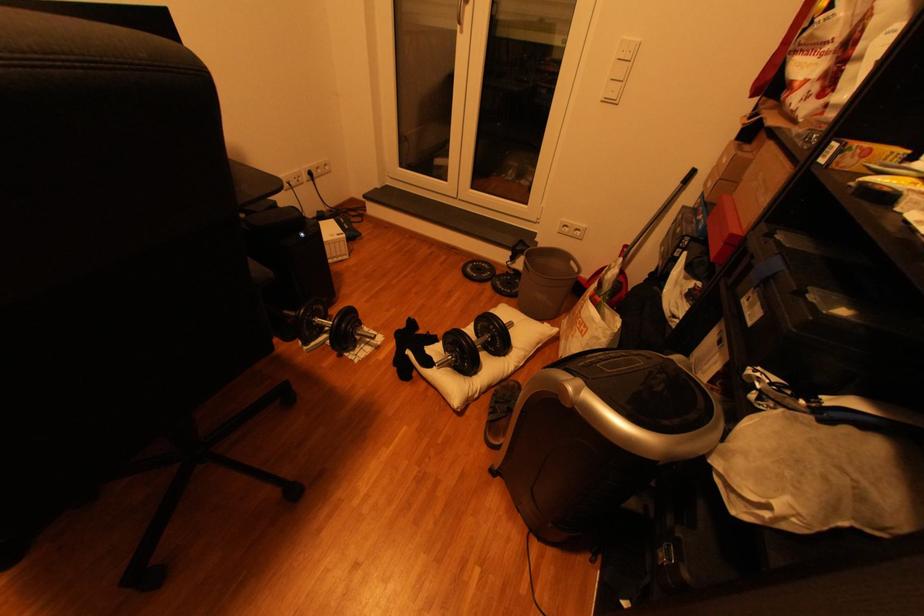
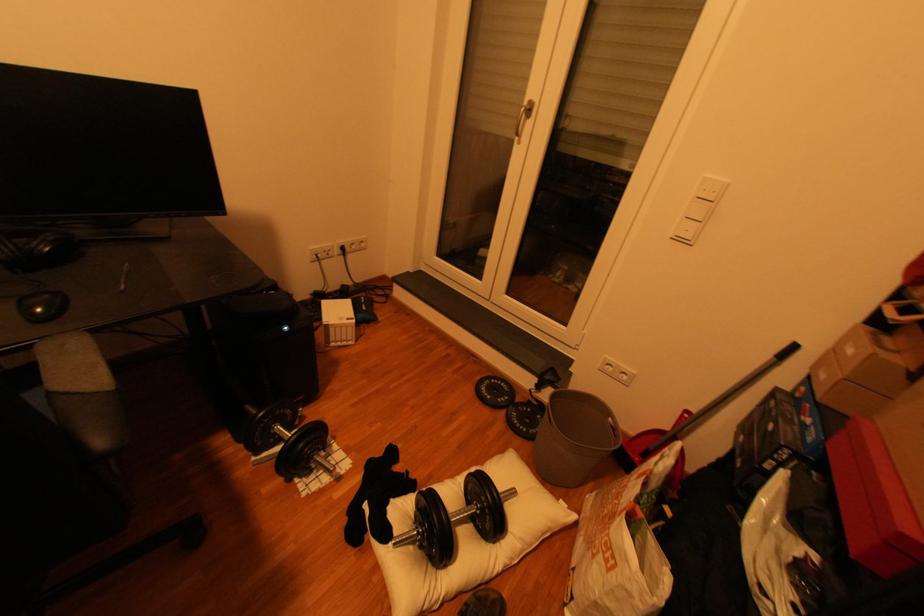
In the second image, find the point that corresponds to point (482, 270) in the first image.

(497, 389)